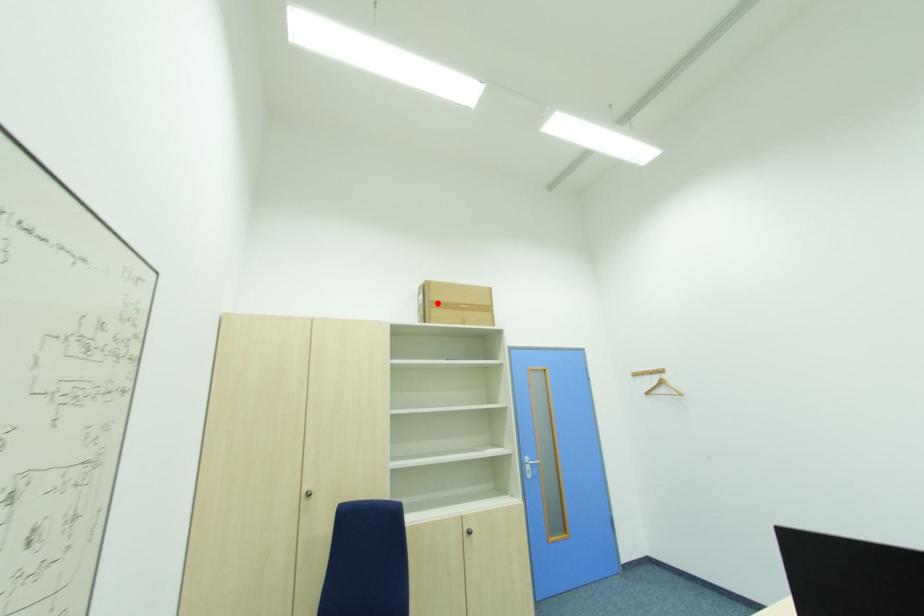
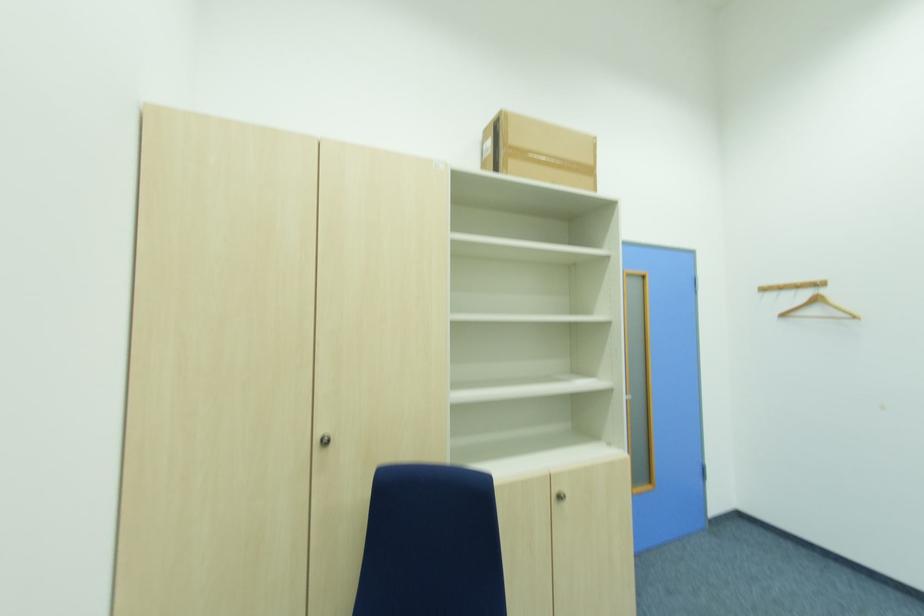
In the second image, find the point that corresponds to the highlighted location in the first image.

(515, 150)